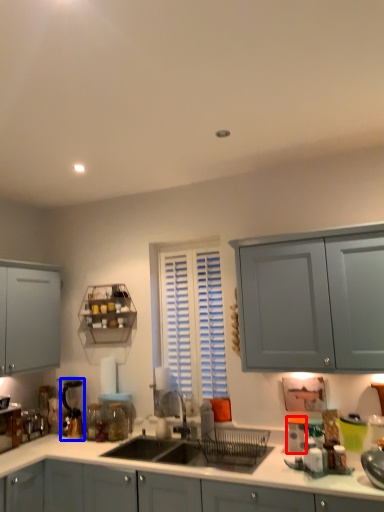
Question: Which object appears farthest to the camera in this image, appliance (highlighted by a red box) or coffee machine (highlighted by a blue box)?

Choices:
 (A) appliance
 (B) coffee machine

Answer: (B)